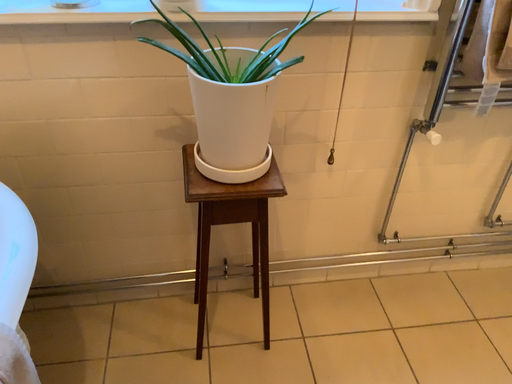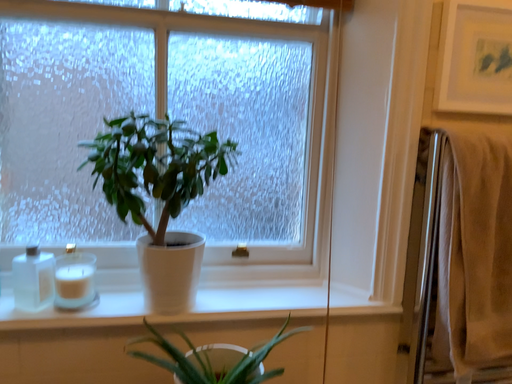
Question: Which way did the camera rotate in the video?

Choices:
 (A) rotated upward
 (B) rotated downward

Answer: (A)